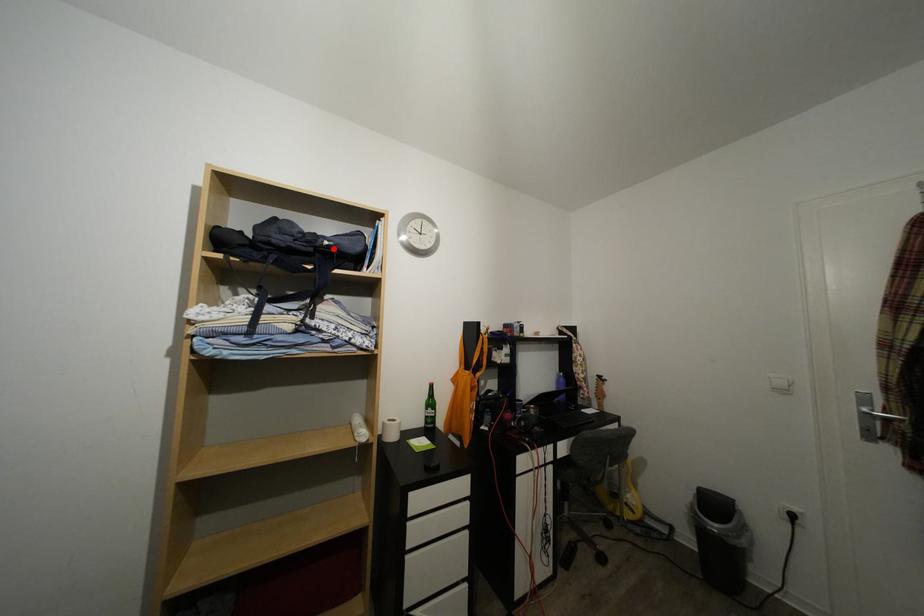
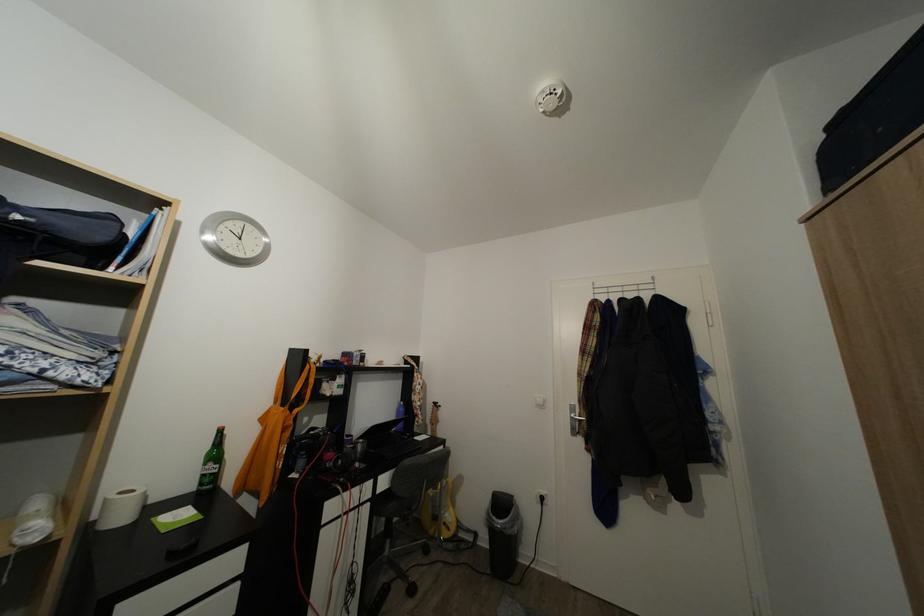
The point at the highlighted location is marked in the first image. Where is the corresponding point in the second image?

(25, 223)